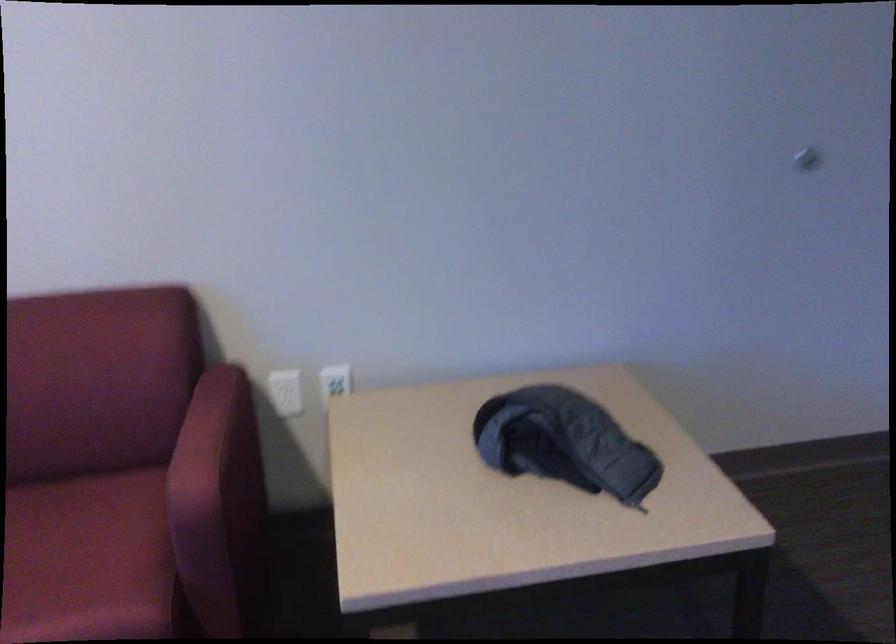
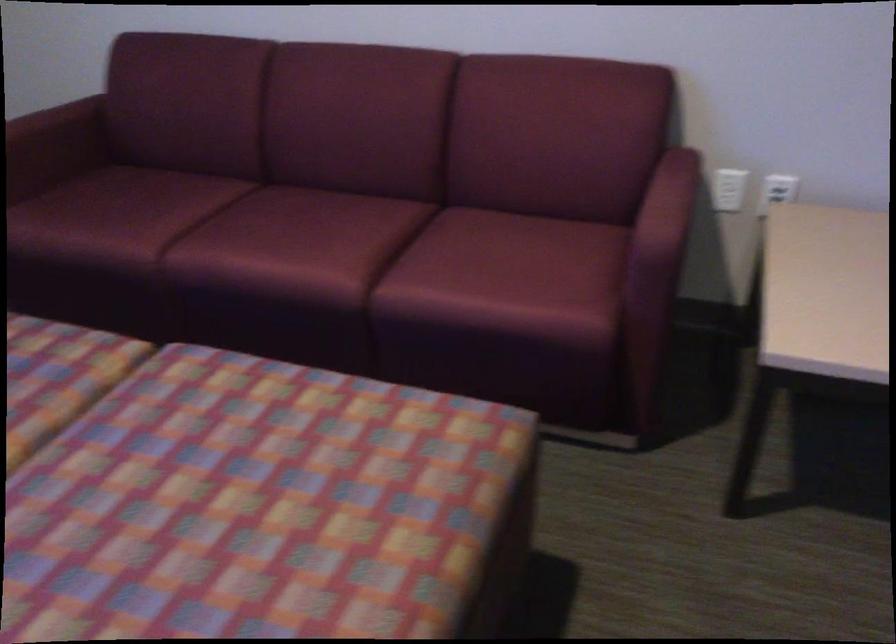
Where in the second image is the point corresponding to [291,390] from the first image?

(728, 189)